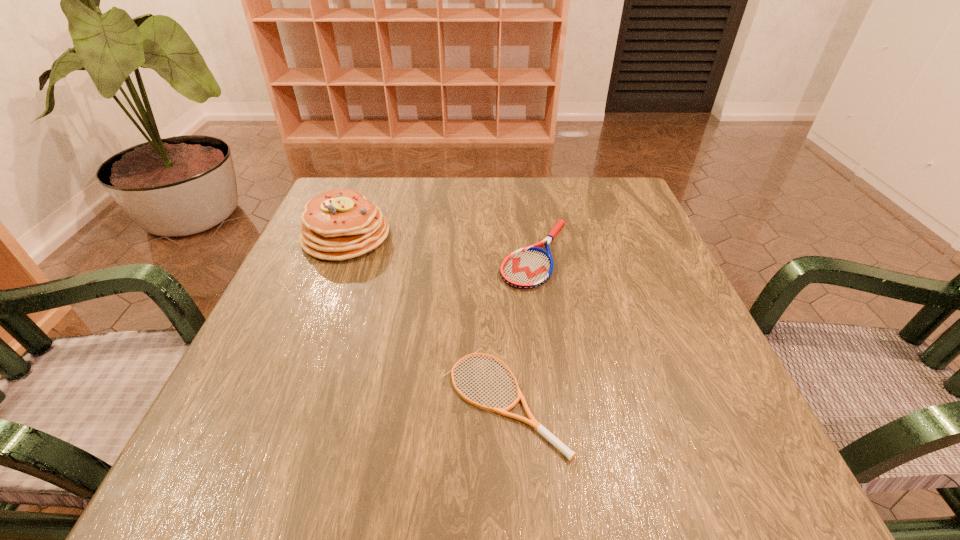
This screenshot has height=540, width=960. Find the location of `tennis racket at the far edge`. tennis racket at the far edge is located at coordinates (530, 267).

Where is `object at the near edge`? The height and width of the screenshot is (540, 960). object at the near edge is located at coordinates (538, 427).

This screenshot has width=960, height=540. In order to click on object that is at the left edge in this screenshot , I will do `click(337, 225)`.

This screenshot has width=960, height=540. I want to click on object that is at the far left corner, so click(x=337, y=225).

In the image, there is a desktop. At what (x,y) coordinates should I click in order to perform the action: click on vacant space at the far edge. Please return your answer as a coordinate pair (x, y). This screenshot has height=540, width=960. Looking at the image, I should click on (504, 214).

In the image, there is a desktop. Find the location of `vacant area at the near edge`. vacant area at the near edge is located at coordinates (384, 446).

The image size is (960, 540). I want to click on vacant region at the left edge of the desktop, so click(328, 381).

The width and height of the screenshot is (960, 540). In the image, there is a desktop. What are the coordinates of `free region at the right edge` in the screenshot? It's located at (732, 395).

In the image, there is a desktop. Identify the location of vacant space at the near left corner. Image resolution: width=960 pixels, height=540 pixels. (247, 474).

At what (x,y) coordinates should I click in order to perform the action: click on vacant space at the far right corner of the desktop. Please return your answer as a coordinate pair (x, y). The width and height of the screenshot is (960, 540). Looking at the image, I should click on (628, 207).